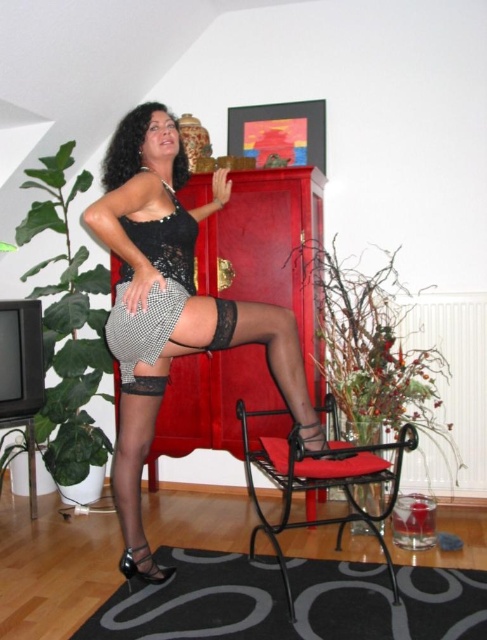
Question: Can you confirm if black lace dress at center is positioned below black lace shorts at center?

Choices:
 (A) no
 (B) yes

Answer: (A)

Question: Which object is positioned farthest from the black lace dress at center?

Choices:
 (A) black lace shorts at center
 (B) black metal armchair at center
 (C) matte black stockings at center

Answer: (B)

Question: Which of the following is the farthest from the observer?

Choices:
 (A) (363, 454)
 (B) (190, 257)
 (C) (216, 298)
 (D) (120, 288)

Answer: (A)

Question: Among these objects, which one is farthest from the camera?

Choices:
 (A) black lace dress at center
 (B) matte black stockings at center
 (C) black metal armchair at center
 (D) black lace shorts at center

Answer: (D)

Question: Can you confirm if matte black stockings at center is bigger than black lace shorts at center?

Choices:
 (A) no
 (B) yes

Answer: (B)

Question: Does black metal armchair at center have a smaller size compared to black lace dress at center?

Choices:
 (A) no
 (B) yes

Answer: (A)